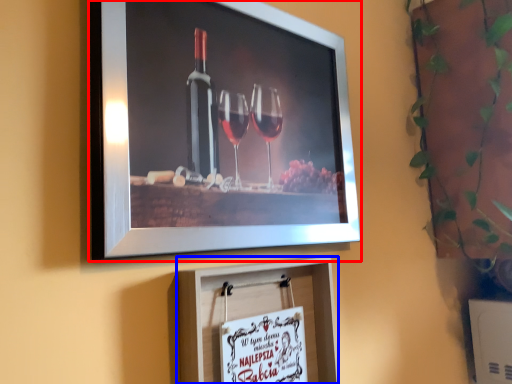
Question: Among these objects, which one is farthest to the camera, picture frame (highlighted by a red box) or picture frame (highlighted by a blue box)?

Choices:
 (A) picture frame
 (B) picture frame

Answer: (B)